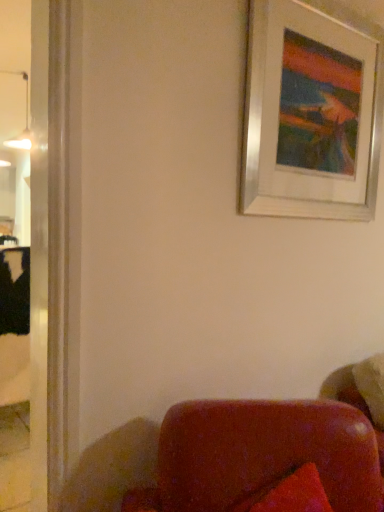
Question: Is silver metallic picture frame at upper right a part of matte white lamp at upper left?

Choices:
 (A) yes
 (B) no

Answer: (B)

Question: From the image's perspective, is matte white lamp at upper left beneath silver metallic picture frame at upper right?

Choices:
 (A) yes
 (B) no

Answer: (B)

Question: Can you confirm if matte white lamp at upper left is positioned to the left of silver metallic picture frame at upper right?

Choices:
 (A) yes
 (B) no

Answer: (A)

Question: Can you confirm if matte white lamp at upper left is positioned to the right of silver metallic picture frame at upper right?

Choices:
 (A) yes
 (B) no

Answer: (B)

Question: Can you confirm if matte white lamp at upper left is bigger than silver metallic picture frame at upper right?

Choices:
 (A) no
 (B) yes

Answer: (A)

Question: Is matte white lamp at upper left oriented away from silver metallic picture frame at upper right?

Choices:
 (A) yes
 (B) no

Answer: (B)

Question: Considering the relative sizes of silver metallic picture frame at upper right and matte white lamp at upper left in the image provided, is silver metallic picture frame at upper right smaller than matte white lamp at upper left?

Choices:
 (A) no
 (B) yes

Answer: (A)

Question: From the image's perspective, does silver metallic picture frame at upper right appear lower than matte white lamp at upper left?

Choices:
 (A) yes
 (B) no

Answer: (A)

Question: Is silver metallic picture frame at upper right not near matte white lamp at upper left?

Choices:
 (A) no
 (B) yes

Answer: (B)

Question: Is silver metallic picture frame at upper right not inside matte white lamp at upper left?

Choices:
 (A) no
 (B) yes

Answer: (B)

Question: Considering the relative positions of silver metallic picture frame at upper right and matte white lamp at upper left in the image provided, is silver metallic picture frame at upper right to the left of matte white lamp at upper left from the viewer's perspective?

Choices:
 (A) yes
 (B) no

Answer: (B)

Question: Could matte white lamp at upper left be considered to be inside silver metallic picture frame at upper right?

Choices:
 (A) yes
 (B) no

Answer: (B)

Question: From their relative heights in the image, would you say silver metallic picture frame at upper right is taller or shorter than matte white lamp at upper left?

Choices:
 (A) short
 (B) tall

Answer: (B)